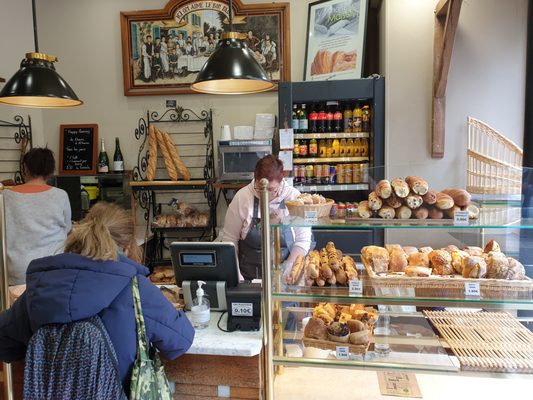
At what (x,y) coordinates should I click in order to perform the action: click on pos register. Please return your answer as a coordinate pair (x, y). Looking at the image, I should click on (208, 261).